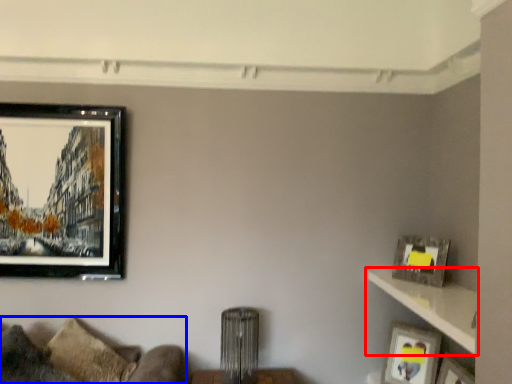
Question: Which object appears farthest to the camera in this image, shelf (highlighted by a red box) or couch (highlighted by a blue box)?

Choices:
 (A) shelf
 (B) couch

Answer: (B)